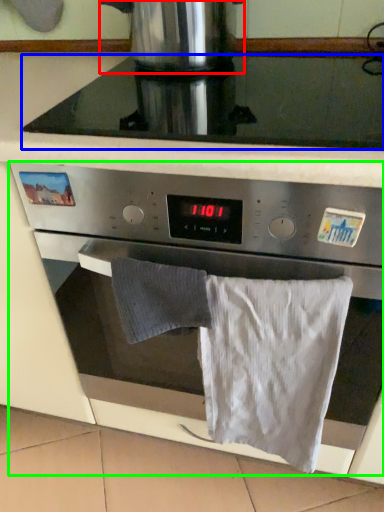
Question: Which object is the closest to the kitchen appliance (highlighted by a red box)? Choose among these: gas stove (highlighted by a blue box) or oven (highlighted by a green box).

Choices:
 (A) gas stove
 (B) oven

Answer: (A)